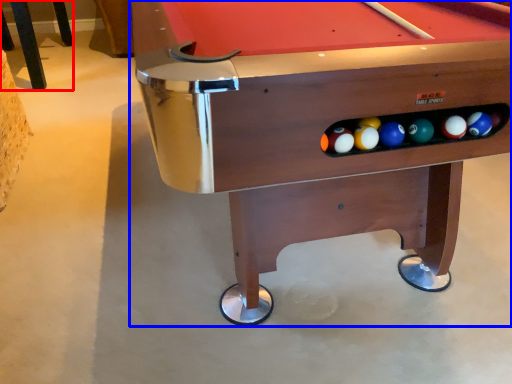
Question: Which object appears farthest to the camera in this image, furniture (highlighted by a red box) or billiard table (highlighted by a blue box)?

Choices:
 (A) furniture
 (B) billiard table

Answer: (A)